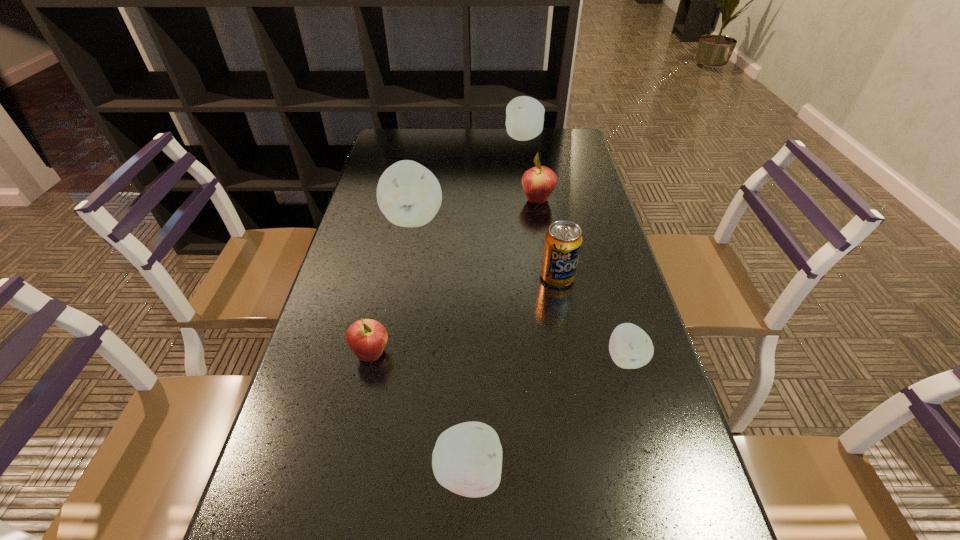
What are the coordinates of `vacant space that satisfies the following two spatial constraints: 1. on the front side of the right red apple; 2. on the left side of the second biggest white apple` in the screenshot? It's located at (533, 200).